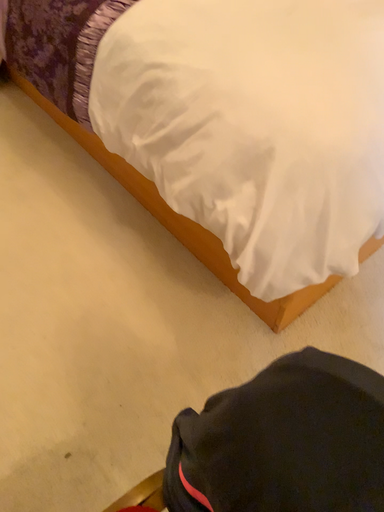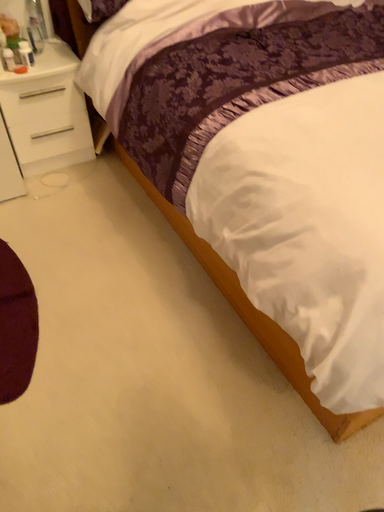
Question: How did the camera likely rotate when shooting the video?

Choices:
 (A) rotated right
 (B) rotated left

Answer: (B)